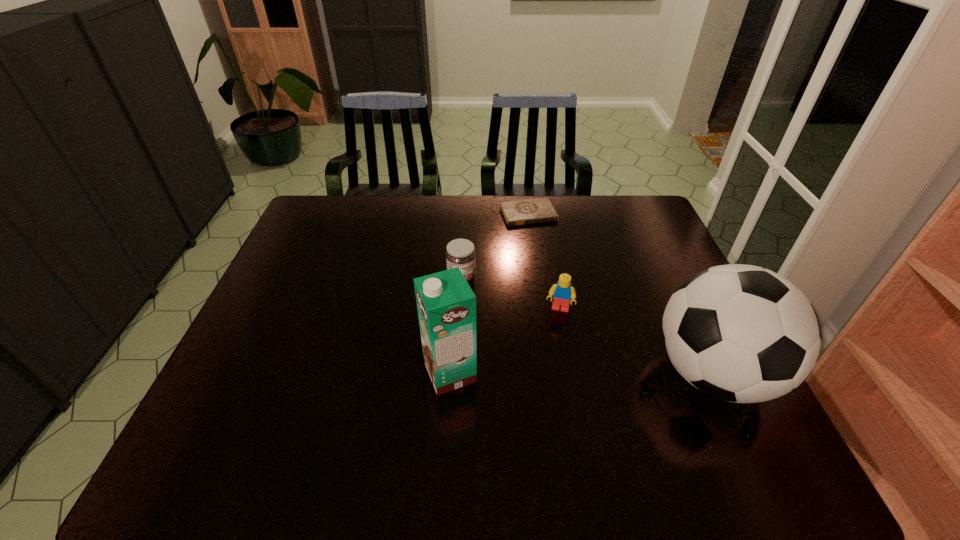
The width and height of the screenshot is (960, 540). In order to click on carton in this screenshot , I will do `click(446, 304)`.

Find the location of a particular element. soccer ball is located at coordinates (741, 333).

You are a GUI agent. You are given a task and a screenshot of the screen. Output one action in this format:
    pyautogui.click(x=<x>, y=<y>)
    Task: Click on the Lego
    This screenshot has height=540, width=960.
    Given the screenshot: What is the action you would take?
    pyautogui.click(x=562, y=292)

Locate an element on the screen. jam is located at coordinates (460, 253).

Identify the location of diary. (530, 211).

At what (x,y) coordinates should I click in order to perform the action: click on the shortest object. Please return your answer as a coordinate pair (x, y). Looking at the image, I should click on (530, 211).

Find the location of a particular element. This screenshot has width=960, height=540. vacant space situated 0.190m on the right of the carton is located at coordinates (557, 373).

You are a GUI agent. You are given a task and a screenshot of the screen. Output one action in this format:
    pyautogui.click(x=<x>, y=<y>)
    Task: Click on the free space located 0.350m on the left of the soccer ball
    Image resolution: width=960 pixels, height=540 pixels.
    Given the screenshot: What is the action you would take?
    pyautogui.click(x=502, y=373)

The height and width of the screenshot is (540, 960). I want to click on vacant space located 0.120m on the front-facing side of the Lego, so pos(551,351).

Where is `free space located 0.190m on the front-facing side of the Lego`? free space located 0.190m on the front-facing side of the Lego is located at coordinates (547, 374).